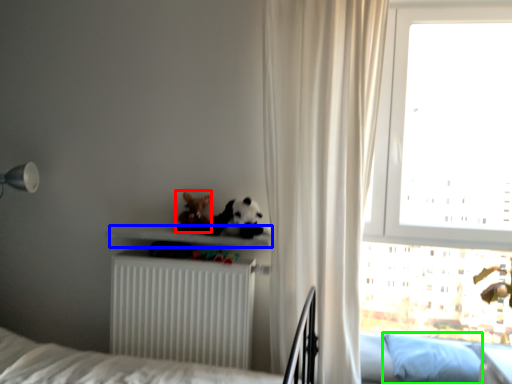
Question: Considering the real-world distances, which object is farthest from miniature (highlighted by a red box)? shelf (highlighted by a blue box) or pillow (highlighted by a green box)?

Choices:
 (A) shelf
 (B) pillow

Answer: (B)